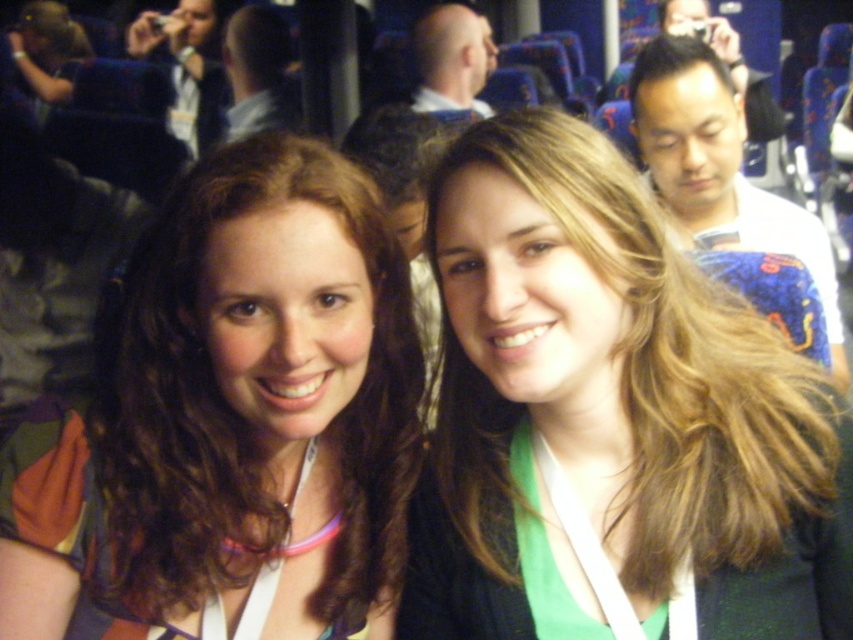
Is matte black camera at upper left above smooth bald head at center?

Yes.

Locate an element on the screen. matte black camera at upper left is located at coordinates (184, 67).

Find the location of `white cotton shirt at upper right`. white cotton shirt at upper right is located at coordinates (718, 168).

Is white cotton shirt at upper right above matte black camera at upper left?

No.

Identify the location of white cotton shirt at upper right. Image resolution: width=853 pixels, height=640 pixels. (718, 168).

Image resolution: width=853 pixels, height=640 pixels. In order to click on white cotton shirt at upper right in this screenshot , I will do [x=718, y=168].

Can you confirm if blonde hair at center is positioned below multicolored fabric at center?

No.

How much distance is there between blonde hair at center and multicolored fabric at center?

They are 6.26 inches apart.

What do you see at coordinates (612, 410) in the screenshot?
I see `blonde hair at center` at bounding box center [612, 410].

Image resolution: width=853 pixels, height=640 pixels. I want to click on blonde hair at center, so click(612, 410).